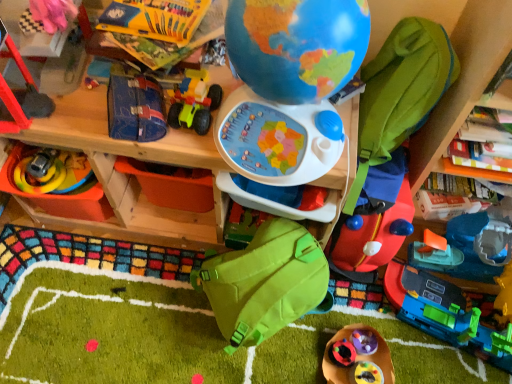
The width and height of the screenshot is (512, 384). Find the location of `empty space that is in between blue fabric case at center, which ranks as the 3th toy in left-to-right order, and rubberized red ladder at left, which is the 2th toy in left-to-right order`. empty space that is in between blue fabric case at center, which ranks as the 3th toy in left-to-right order, and rubberized red ladder at left, which is the 2th toy in left-to-right order is located at coordinates (75, 122).